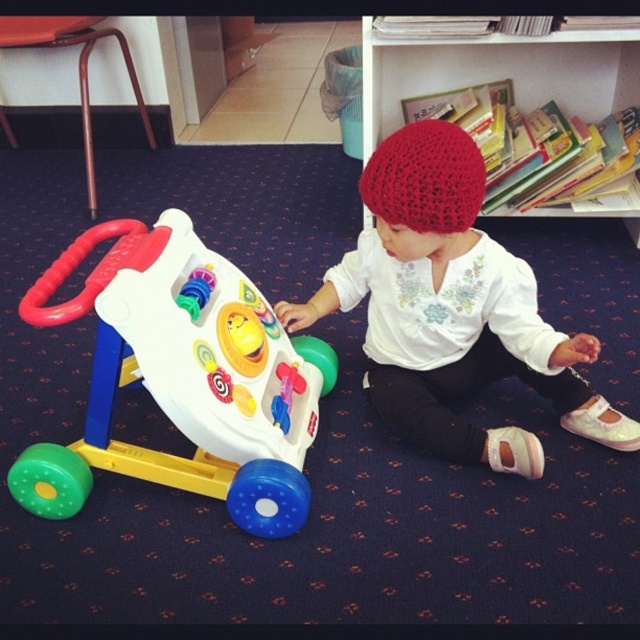
Who is taller, wooden bookshelf at upper center or crochet red hat at center?

wooden bookshelf at upper center

Which is behind, point (582, 80) or point (400, 224)?

The point (582, 80) is more distant.

Where is `wooden bookshelf at upper center`? Image resolution: width=640 pixels, height=640 pixels. wooden bookshelf at upper center is located at coordinates (499, 72).

Can you confirm if white matte shirt at center is positioned above crochet red hat at center?

Incorrect, white matte shirt at center is not positioned above crochet red hat at center.

Does white matte shirt at center appear on the right side of crochet red hat at center?

Indeed, white matte shirt at center is positioned on the right side of crochet red hat at center.

Describe the element at coordinates (451, 308) in the screenshot. The height and width of the screenshot is (640, 640). I see `white matte shirt at center` at that location.

Find the location of `white matte shirt at center`. white matte shirt at center is located at coordinates pyautogui.click(x=451, y=308).

Can you confirm if plastic walker at left is taller than white matte shirt at center?

No.

Can you confirm if plastic walker at left is thinner than white matte shirt at center?

Yes.

Which is behind, point (205, 388) or point (435, 296)?

The point (435, 296) is more distant.

I want to click on plastic walker at left, so (182, 378).